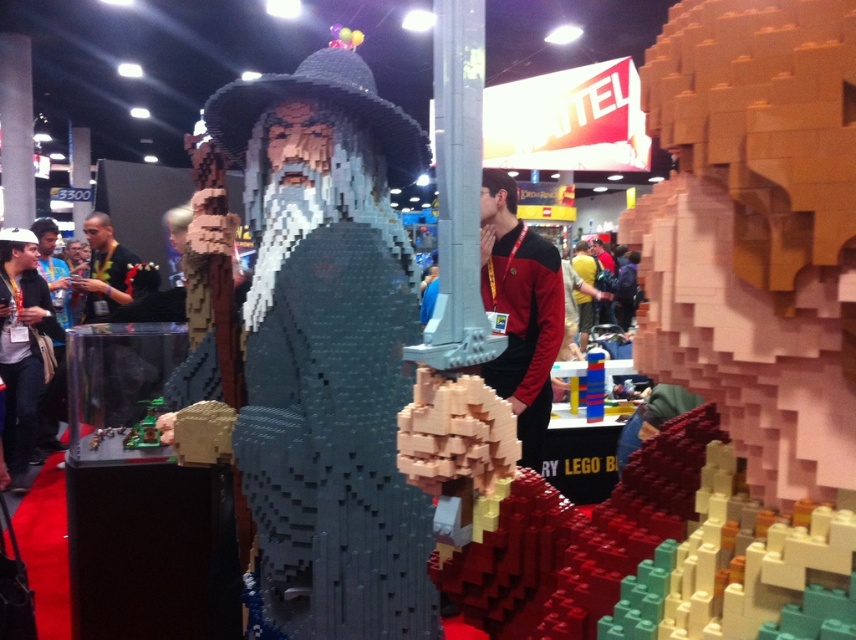
Is black fabric shirt at left smaller than metallic green toy at center?

No.

Which is more to the right, black fabric shirt at left or metallic green toy at center?

Positioned to the right is metallic green toy at center.

This screenshot has width=856, height=640. Describe the element at coordinates (103, 269) in the screenshot. I see `black fabric shirt at left` at that location.

The image size is (856, 640). In order to click on black fabric shirt at left in this screenshot , I will do `click(103, 269)`.